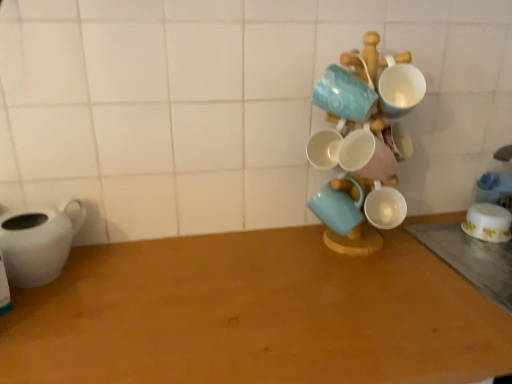
Question: Is wooden table at center, positioned as the 1th table in left-to-right order, wider than matte ceramic mug at center, the second coffee cup when ordered from back to front?

Choices:
 (A) no
 (B) yes

Answer: (B)

Question: Are wooden table at center, positioned as the 2th table in right-to-left order, and matte ceramic mug at center, the second coffee cup when ordered from back to front, far apart?

Choices:
 (A) no
 (B) yes

Answer: (A)

Question: From the image's perspective, would you say wooden table at center, positioned as the 2th table in right-to-left order, is shown under matte ceramic mug at center, the 1th coffee cup when ordered from left to right?

Choices:
 (A) yes
 (B) no

Answer: (A)

Question: Is wooden table at center, positioned as the 1th table in left-to-right order, closer to camera compared to matte ceramic mug at center, which ranks as the 2th coffee cup in right-to-left order?

Choices:
 (A) no
 (B) yes

Answer: (B)

Question: From a real-world perspective, is wooden table at center, positioned as the 1th table in left-to-right order, positioned under matte ceramic mug at center, the first coffee cup viewed from the front, based on gravity?

Choices:
 (A) yes
 (B) no

Answer: (A)

Question: Is wooden table at center, positioned as the 2th table in right-to-left order, bigger than matte ceramic mug at center, the second coffee cup when ordered from back to front?

Choices:
 (A) yes
 (B) no

Answer: (A)

Question: From the image's perspective, is white glossy bowl at right, the 2th coffee cup positioned from the front, above white glossy mugs at center-right?

Choices:
 (A) yes
 (B) no

Answer: (B)

Question: Can you confirm if white glossy bowl at right, which appears as the 1th coffee cup when viewed from the right, is shorter than white glossy mugs at center-right?

Choices:
 (A) no
 (B) yes

Answer: (B)

Question: Can you confirm if white glossy bowl at right, the 2th coffee cup when ordered from left to right, is smaller than white glossy mugs at center-right?

Choices:
 (A) no
 (B) yes

Answer: (B)

Question: From a real-world perspective, does white glossy bowl at right, the 2th coffee cup positioned from the front, sit lower than white glossy mugs at center-right?

Choices:
 (A) no
 (B) yes

Answer: (B)

Question: Can you confirm if white glossy bowl at right, the 2th coffee cup positioned from the front, is thinner than white glossy mugs at center-right?

Choices:
 (A) no
 (B) yes

Answer: (B)

Question: Is white glossy mugs at center-right completely or partially inside white glossy bowl at right, the 2th coffee cup when ordered from left to right?

Choices:
 (A) no
 (B) yes

Answer: (A)

Question: Is white glossy mugs at center-right positioned behind white matte teapot at left?

Choices:
 (A) no
 (B) yes

Answer: (A)